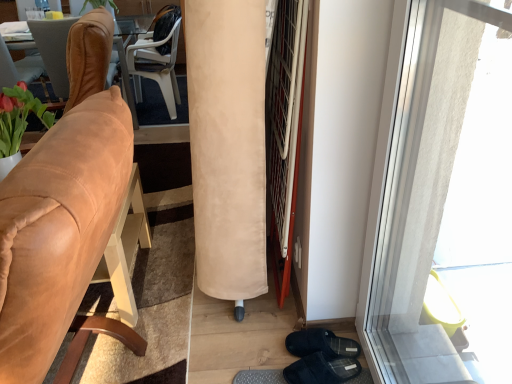
Describe the element at coordinates (228, 145) in the screenshot. The height and width of the screenshot is (384, 512). I see `beige suede curtain at center` at that location.

Measure the distance between point (144,76) and camera.

A distance of 3.65 meters exists between point (144,76) and camera.

Find the location of a particular element. This screenshot has height=384, width=512. white plastic chair at upper center, which is the 3th chair from front to back is located at coordinates (156, 67).

Describe the element at coordinates (58, 229) in the screenshot. I see `suede tan chair at left, which is the first chair from front to back` at that location.

I want to click on beige suede curtain at center, so click(228, 145).

Considering the sizes of objects white plastic chair at upper center, which is the 3th chair from front to back, and suede tan chair at left, which is the 3th chair in back-to-front order, in the image provided, who is smaller, white plastic chair at upper center, which is the 3th chair from front to back, or suede tan chair at left, which is the 3th chair in back-to-front order,?

white plastic chair at upper center, which is the 3th chair from front to back.

From the image's perspective, is white plastic chair at upper center, which is the first chair in back-to-front order, above or below suede tan chair at left, which is the 3th chair in back-to-front order?

white plastic chair at upper center, which is the first chair in back-to-front order, is above suede tan chair at left, which is the 3th chair in back-to-front order.

Does white plastic chair at upper center, which is the 3th chair from front to back, lie behind suede tan chair at left, which is the first chair from front to back?

Yes, white plastic chair at upper center, which is the 3th chair from front to back, is behind suede tan chair at left, which is the first chair from front to back.

Is suede tan chair at left, which is the 3th chair in back-to-front order, surrounded by white plastic chair at upper center, which is the first chair in back-to-front order?

That's incorrect, suede tan chair at left, which is the 3th chair in back-to-front order, is not inside white plastic chair at upper center, which is the first chair in back-to-front order.

Are beige suede curtain at center and suede tan chair at left, which is the first chair from front to back, far apart?

No, there isn't a large distance between beige suede curtain at center and suede tan chair at left, which is the first chair from front to back.

Find the location of a particular element. chair in front of the beige suede curtain at center is located at coordinates (58, 229).

Is beige suede curtain at center positioned behind suede tan chair at left, which is the first chair from front to back?

Yes.

In the scene shown: Which object is positioned more to the left, beige suede curtain at center or white plastic chair at upper center, which is the 3th chair from front to back?

white plastic chair at upper center, which is the 3th chair from front to back, is more to the left.

Considering the relative sizes of beige suede curtain at center and white plastic chair at upper center, which is the 3th chair from front to back, in the image provided, is beige suede curtain at center wider than white plastic chair at upper center, which is the 3th chair from front to back,?

In fact, beige suede curtain at center might be narrower than white plastic chair at upper center, which is the 3th chair from front to back.

From the picture: Does beige suede curtain at center lie in front of white plastic chair at upper center, which is the first chair in back-to-front order?

Yes, beige suede curtain at center is closer to the camera.

Between beige suede curtain at center and transparent glass window at right, which one has smaller width?

Thinner between the two is transparent glass window at right.

Is transparent glass window at right inside beige suede curtain at center?

That's incorrect, transparent glass window at right is not inside beige suede curtain at center.

Are beige suede curtain at center and transparent glass window at right far apart?

beige suede curtain at center is near transparent glass window at right, not far away.

From a real-world perspective, is beige suede curtain at center physically above transparent glass window at right?

No, from a real-world perspective, beige suede curtain at center is not over transparent glass window at right

In the scene shown: Is white plastic chair at upper center, which is the 3th chair from front to back, next to brown leather chair at left, the second chair positioned from the back, and touching it?

No, white plastic chair at upper center, which is the 3th chair from front to back, is not beside brown leather chair at left, the second chair positioned from the back.

Image resolution: width=512 pixels, height=384 pixels. Identify the location of chair behind the brown leather chair at left, positioned as the second chair in front-to-back order. (156, 67).

Can you confirm if white plastic chair at upper center, which is the first chair in back-to-front order, is wider than beige suede curtain at center?

Yes, white plastic chair at upper center, which is the first chair in back-to-front order, is wider than beige suede curtain at center.

In terms of height, does white plastic chair at upper center, which is the 3th chair from front to back, look taller or shorter compared to beige suede curtain at center?

white plastic chair at upper center, which is the 3th chair from front to back, is shorter than beige suede curtain at center.

Which is nearer, (178, 103) or (226, 35)?

Point (178, 103).

Which object is thinner, suede tan chair at left, which is the first chair from front to back, or transparent glass window at right?

transparent glass window at right.

In the scene shown: Considering the sizes of objects suede tan chair at left, which is the 3th chair in back-to-front order, and transparent glass window at right in the image provided, who is smaller, suede tan chair at left, which is the 3th chair in back-to-front order, or transparent glass window at right?

Smaller between the two is transparent glass window at right.

Does point (10, 280) lie behind point (408, 54)?

No, (10, 280) is closer to viewer.

What's the angular difference between suede tan chair at left, which is the 3th chair in back-to-front order, and transparent glass window at right's facing directions?

suede tan chair at left, which is the 3th chair in back-to-front order, and transparent glass window at right are facing 2.38 degrees away from each other.

The width and height of the screenshot is (512, 384). I want to click on the 2nd chair behind the suede tan chair at left, which is the first chair from front to back, so click(x=156, y=67).

Locate an element on the screen. curtain located above the suede tan chair at left, which is the first chair from front to back (from the image's perspective) is located at coordinates (228, 145).

When comparing their distances from transparent glass window at right, does suede tan chair at left, which is the 3th chair in back-to-front order, or white plastic chair at upper center, which is the first chair in back-to-front order, seem further?

white plastic chair at upper center, which is the first chair in back-to-front order, lies further to transparent glass window at right than the other object.

Based on their spatial positions, is beige suede curtain at center or suede tan chair at left, which is the 3th chair in back-to-front order, further from transparent glass window at right?

The object further to transparent glass window at right is suede tan chair at left, which is the 3th chair in back-to-front order.

Estimate the real-world distances between objects in this image. Which object is further from suede tan chair at left, which is the first chair from front to back, brown leather chair at left, positioned as the second chair in front-to-back order, or beige suede curtain at center?

brown leather chair at left, positioned as the second chair in front-to-back order.

When comparing their distances from beige suede curtain at center, does brown leather chair at left, positioned as the second chair in front-to-back order, or white plastic chair at upper center, which is the first chair in back-to-front order, seem closer?

The object closer to beige suede curtain at center is brown leather chair at left, positioned as the second chair in front-to-back order.

Which object lies further to the anchor point transparent glass window at right, beige suede curtain at center or brown leather chair at left, the second chair positioned from the back?

brown leather chair at left, the second chair positioned from the back, lies further to transparent glass window at right than the other object.

Which object lies further to the anchor point beige suede curtain at center, white plastic chair at upper center, which is the 3th chair from front to back, or transparent glass window at right?

white plastic chair at upper center, which is the 3th chair from front to back.

From the image, which object appears to be farther from white plastic chair at upper center, which is the first chair in back-to-front order, suede tan chair at left, which is the 3th chair in back-to-front order, or beige suede curtain at center?

Among the two, suede tan chair at left, which is the 3th chair in back-to-front order, is located further to white plastic chair at upper center, which is the first chair in back-to-front order.

Looking at the image, which one is located further to white plastic chair at upper center, which is the 3th chair from front to back, transparent glass window at right or beige suede curtain at center?

transparent glass window at right is positioned further to the anchor white plastic chair at upper center, which is the 3th chair from front to back.

Where is `curtain between suede tan chair at left, which is the first chair from front to back, and brown leather chair at left, positioned as the second chair in front-to-back order, along the z-axis`? This screenshot has width=512, height=384. curtain between suede tan chair at left, which is the first chair from front to back, and brown leather chair at left, positioned as the second chair in front-to-back order, along the z-axis is located at coordinates (228, 145).

What are the coordinates of `chair between beige suede curtain at center and white plastic chair at upper center, which is the 3th chair from front to back, from front to back` in the screenshot? It's located at pyautogui.click(x=77, y=54).

Identify the location of curtain between suede tan chair at left, which is the 3th chair in back-to-front order, and transparent glass window at right, in the horizontal direction. (228, 145).

The image size is (512, 384). I want to click on curtain positioned between transparent glass window at right and brown leather chair at left, positioned as the second chair in front-to-back order, from near to far, so click(228, 145).